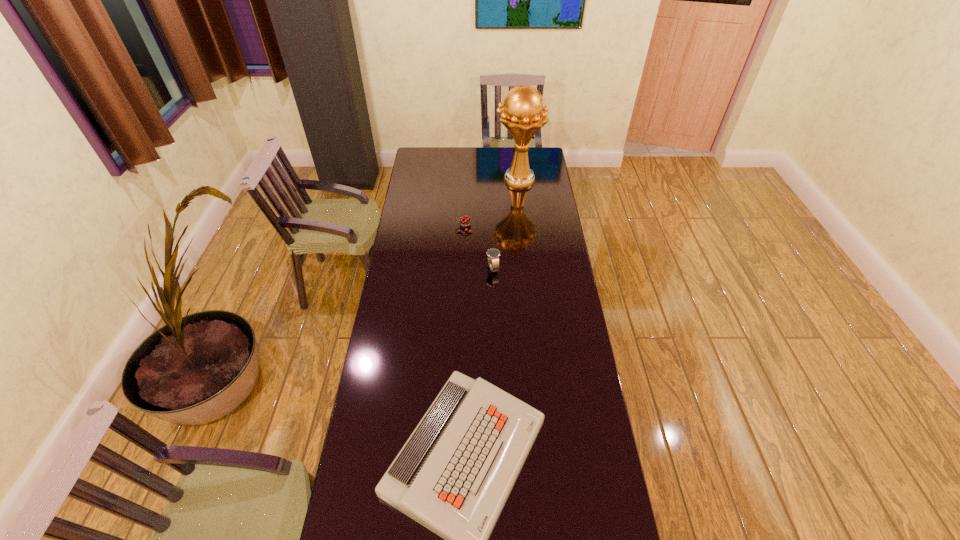
What are the coordinates of `object identified as the second closest to the computer keyboard` in the screenshot? It's located at (465, 222).

Where is `object that stands as the closest to the cherry`? object that stands as the closest to the cherry is located at coordinates (493, 254).